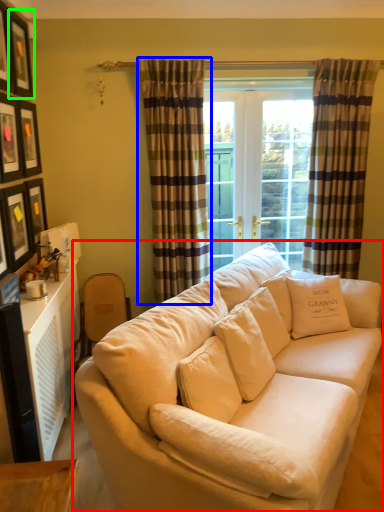
Question: Estimate the real-world distances between objects in this image. Which object is closer to studio couch (highlighted by a red box), curtain (highlighted by a blue box) or picture frame (highlighted by a green box)?

Choices:
 (A) curtain
 (B) picture frame

Answer: (A)